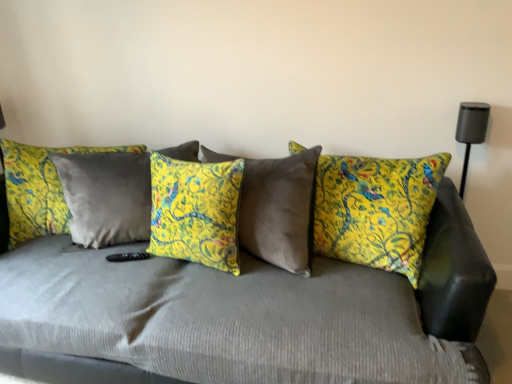
Question: Does velvet gray couch at center have a greater height compared to yellow floral pillow at center, which is counted as the first pillow, starting from the left?

Choices:
 (A) no
 (B) yes

Answer: (B)

Question: Is velvet gray couch at center beside yellow floral pillow at center, which is counted as the first pillow, starting from the left?

Choices:
 (A) no
 (B) yes

Answer: (A)

Question: Considering the relative sizes of velvet gray couch at center and yellow floral pillow at center, placed as the third pillow when sorted from right to left, in the image provided, is velvet gray couch at center shorter than yellow floral pillow at center, placed as the third pillow when sorted from right to left,?

Choices:
 (A) no
 (B) yes

Answer: (A)

Question: Does velvet gray couch at center have a lesser width compared to yellow floral pillow at center, placed as the third pillow when sorted from right to left?

Choices:
 (A) yes
 (B) no

Answer: (B)

Question: Is velvet gray couch at center oriented towards yellow floral pillow at center, placed as the third pillow when sorted from right to left?

Choices:
 (A) yes
 (B) no

Answer: (A)

Question: Is yellow floral pillow at center, placed as the third pillow when sorted from right to left, spatially inside yellow fabric pillow at center, the second pillow when ordered from right to left, or outside of it?

Choices:
 (A) inside
 (B) outside

Answer: (B)

Question: In the image, is yellow floral pillow at center, placed as the third pillow when sorted from right to left, positioned in front of or behind yellow fabric pillow at center, the second pillow viewed from the left?

Choices:
 (A) front
 (B) behind

Answer: (B)

Question: Is point (13, 215) closer or farther from the camera than point (181, 178)?

Choices:
 (A) farther
 (B) closer

Answer: (A)

Question: From the image's perspective, is yellow floral pillow at center, which is counted as the first pillow, starting from the left, located above or below yellow fabric pillow at center, the second pillow viewed from the left?

Choices:
 (A) below
 (B) above

Answer: (B)

Question: Considering the positions of yellow floral cushion at center, placed as the first pillow when sorted from right to left, and yellow fabric pillow at center, the second pillow viewed from the left, in the image, is yellow floral cushion at center, placed as the first pillow when sorted from right to left, wider or thinner than yellow fabric pillow at center, the second pillow viewed from the left,?

Choices:
 (A) thin
 (B) wide

Answer: (B)

Question: From the image's perspective, relative to yellow fabric pillow at center, the second pillow viewed from the left, is yellow floral cushion at center, placed as the first pillow when sorted from right to left, above or below?

Choices:
 (A) below
 (B) above

Answer: (B)

Question: Is yellow floral cushion at center, placed as the first pillow when sorted from right to left, taller or shorter than yellow fabric pillow at center, the second pillow viewed from the left?

Choices:
 (A) short
 (B) tall

Answer: (B)

Question: Does point coord(381,223) appear closer or farther from the camera than point coord(168,206)?

Choices:
 (A) farther
 (B) closer

Answer: (B)

Question: Is yellow floral pillow at center, which is counted as the first pillow, starting from the left, to the left or to the right of yellow floral cushion at center, placed as the first pillow when sorted from right to left, in the image?

Choices:
 (A) right
 (B) left

Answer: (B)

Question: Considering the positions of yellow floral pillow at center, placed as the third pillow when sorted from right to left, and yellow floral cushion at center, positioned as the 3th pillow in left-to-right order, in the image, is yellow floral pillow at center, placed as the third pillow when sorted from right to left, bigger or smaller than yellow floral cushion at center, positioned as the 3th pillow in left-to-right order,?

Choices:
 (A) big
 (B) small

Answer: (B)